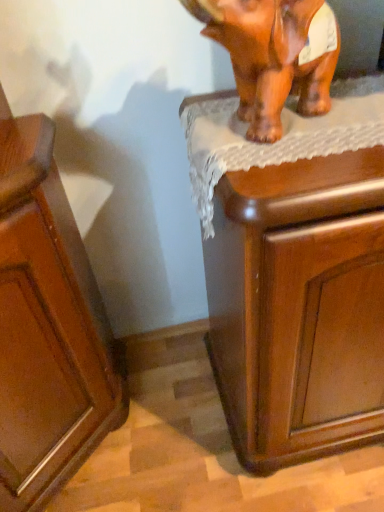
Question: Is glossy wood cabinet at lower left touching wooden cabinet at upper right?

Choices:
 (A) yes
 (B) no

Answer: (B)

Question: Is glossy wood cabinet at lower left shorter than wooden cabinet at upper right?

Choices:
 (A) yes
 (B) no

Answer: (B)

Question: Can you confirm if glossy wood cabinet at lower left is taller than wooden cabinet at upper right?

Choices:
 (A) no
 (B) yes

Answer: (B)

Question: Is glossy wood cabinet at lower left facing away from wooden cabinet at upper right?

Choices:
 (A) no
 (B) yes

Answer: (A)

Question: Is glossy wood cabinet at lower left outside of wooden cabinet at upper right?

Choices:
 (A) no
 (B) yes

Answer: (B)

Question: Is glossy wood cabinet at lower left further to camera compared to wooden cabinet at upper right?

Choices:
 (A) yes
 (B) no

Answer: (B)

Question: Does wooden cabinet at upper right lie behind glossy wood cabinet at lower left?

Choices:
 (A) no
 (B) yes

Answer: (B)

Question: From a real-world perspective, does wooden cabinet at upper right stand above glossy wood cabinet at lower left?

Choices:
 (A) yes
 (B) no

Answer: (B)

Question: Are wooden cabinet at upper right and glossy wood cabinet at lower left located far from each other?

Choices:
 (A) no
 (B) yes

Answer: (A)

Question: Is wooden cabinet at upper right bigger than glossy wood cabinet at lower left?

Choices:
 (A) yes
 (B) no

Answer: (A)

Question: Is wooden cabinet at upper right aimed at glossy wood cabinet at lower left?

Choices:
 (A) yes
 (B) no

Answer: (B)

Question: Is the depth of wooden cabinet at upper right less than that of glossy wood cabinet at lower left?

Choices:
 (A) yes
 (B) no

Answer: (B)

Question: Would you say brown glossy elephant at upper right contains glossy wood cabinet at lower left?

Choices:
 (A) yes
 (B) no

Answer: (B)